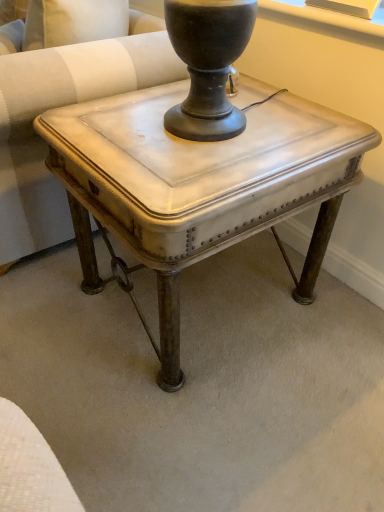
Question: Does white painted wood table at center touch white leather swivel chair at center?

Choices:
 (A) yes
 (B) no

Answer: (B)

Question: From a real-world perspective, is white painted wood table at center below white leather swivel chair at center?

Choices:
 (A) yes
 (B) no

Answer: (A)

Question: Considering the relative sizes of white painted wood table at center and white leather swivel chair at center in the image provided, is white painted wood table at center smaller than white leather swivel chair at center?

Choices:
 (A) yes
 (B) no

Answer: (A)

Question: Does white painted wood table at center have a lesser height compared to white leather swivel chair at center?

Choices:
 (A) yes
 (B) no

Answer: (A)

Question: Is white painted wood table at center closer to camera compared to white leather swivel chair at center?

Choices:
 (A) no
 (B) yes

Answer: (B)

Question: Is white painted wood table at center facing towards white leather swivel chair at center?

Choices:
 (A) yes
 (B) no

Answer: (B)

Question: Is the depth of white leather swivel chair at center greater than that of white painted wood table at center?

Choices:
 (A) no
 (B) yes

Answer: (B)

Question: Are white leather swivel chair at center and white painted wood table at center located far from each other?

Choices:
 (A) no
 (B) yes

Answer: (A)

Question: Is white leather swivel chair at center oriented towards white painted wood table at center?

Choices:
 (A) yes
 (B) no

Answer: (B)

Question: Would you say white painted wood table at center is part of white leather swivel chair at center's contents?

Choices:
 (A) yes
 (B) no

Answer: (B)

Question: Is white leather swivel chair at center bigger than white painted wood table at center?

Choices:
 (A) yes
 (B) no

Answer: (A)

Question: From the image's perspective, is white leather swivel chair at center beneath white painted wood table at center?

Choices:
 (A) yes
 (B) no

Answer: (B)

Question: Is white painted wood table at center inside or outside of white leather swivel chair at center?

Choices:
 (A) inside
 (B) outside

Answer: (B)